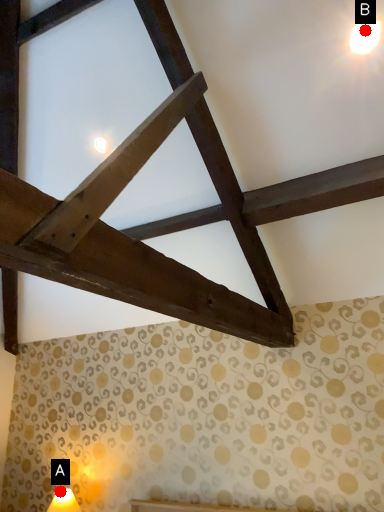
Question: Two points are circled on the image, labeled by A and B beside each circle. Among these points, which one is nearest to the camera?

Choices:
 (A) A is closer
 (B) B is closer

Answer: (B)